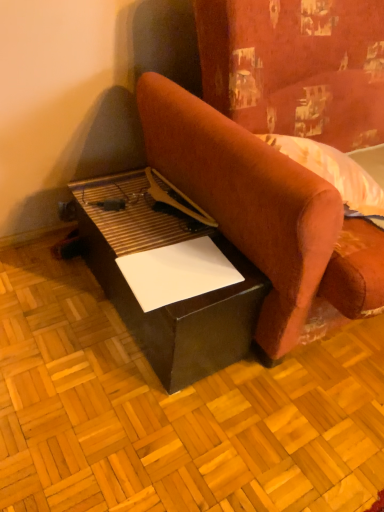
Find the location of a particular element. vacant space to the right of black leather table at lower left is located at coordinates (321, 389).